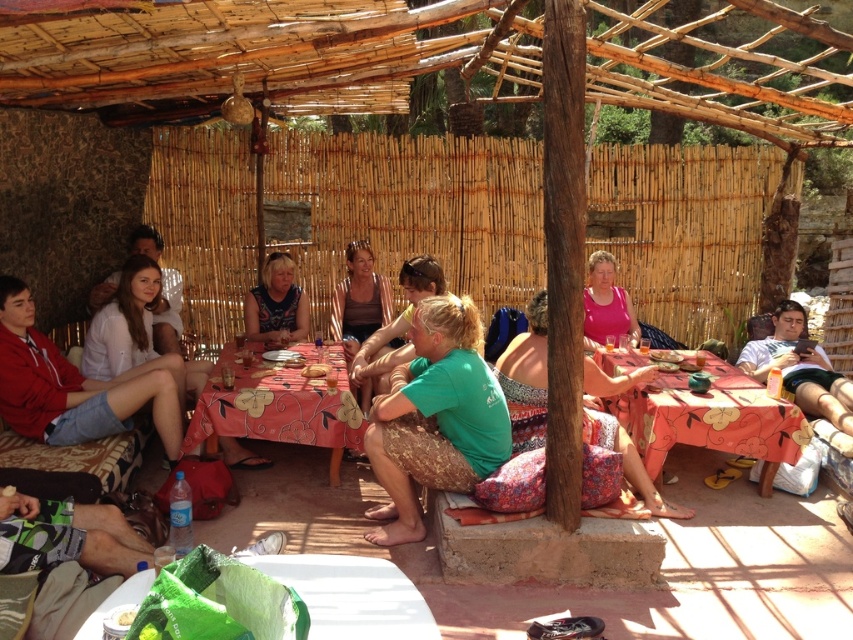
You are standing at the center of the image and want to reach the green paper bag at lower left. Which direction should you move to get there?

To reach the green paper bag at lower left, you should move towards the lower left direction from the center of the image.

You are a photographer taking a group photo of the people at the gathering. You notice the blue printed dress at center and the pink matte shirt at center. Which clothing item should you focus on first to ensure the entire length of both items is captured in the frame?

The blue printed dress at center is shorter than the pink matte shirt at center, so you should focus on the pink matte shirt at center first to ensure its full length is captured since it is longer and might require more framing space.

You are attending a picnic and see two people wearing the blue printed dress at center and the pink matte shirt at center. Which person is sitting higher up?

The blue printed dress at center is above the pink matte shirt at center, so the person wearing the blue printed dress at center is sitting higher up.